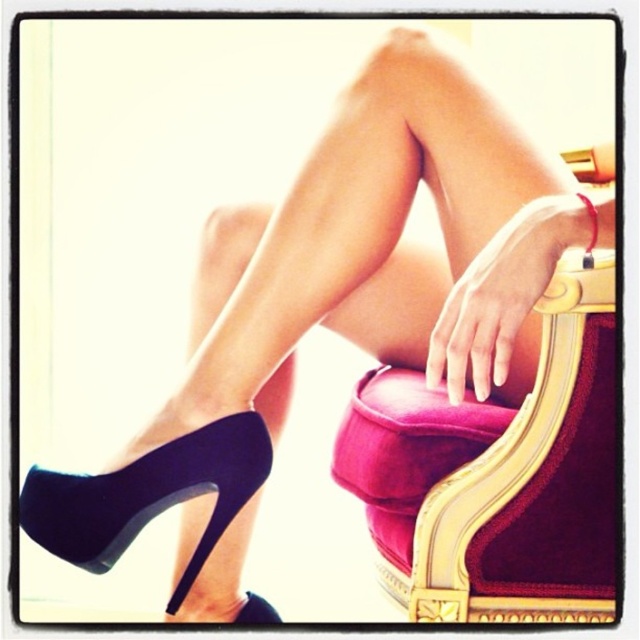
Who is more forward, (401,433) or (122,547)?

Point (401,433) is more forward.

Is point (577, 292) positioned before point (160, 452)?

Yes, point (577, 292) is in front of point (160, 452).

Locate an element on the screen. This screenshot has height=640, width=640. velvet gold armchair at center is located at coordinates (499, 474).

What do you see at coordinates (499, 474) in the screenshot?
I see `velvet gold armchair at center` at bounding box center [499, 474].

Between point (554, 339) and point (252, 602), which one is positioned in front?

Positioned in front is point (554, 339).

Who is more distant from viewer, (522, 403) or (250, 611)?

Point (250, 611)

At what (x,y) coordinates should I click in order to perform the action: click on velvet gold armchair at center. Please return your answer as a coordinate pair (x, y). The width and height of the screenshot is (640, 640). Looking at the image, I should click on (499, 474).

Can you confirm if suede black high-heeled shoe at lower left is wider than suede high-heeled shoe at lower left?

Yes, suede black high-heeled shoe at lower left is wider than suede high-heeled shoe at lower left.

Can you confirm if suede black high-heeled shoe at lower left is thinner than suede high-heeled shoe at lower left?

Incorrect, suede black high-heeled shoe at lower left's width is not less than suede high-heeled shoe at lower left's.

Who is more forward, (112, 548) or (246, 620)?

Point (112, 548) is more forward.

The image size is (640, 640). I want to click on suede black high-heeled shoe at lower left, so click(x=148, y=496).